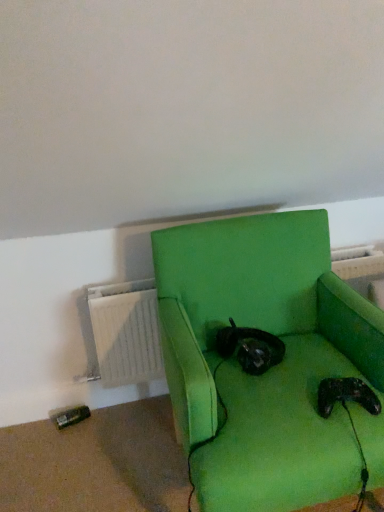
Locate an element on the screen. green fabric chair at center is located at coordinates (270, 368).

The height and width of the screenshot is (512, 384). Describe the element at coordinates (270, 368) in the screenshot. I see `green fabric chair at center` at that location.

What are the coordinates of `green fabric chair at center` in the screenshot? It's located at (270, 368).